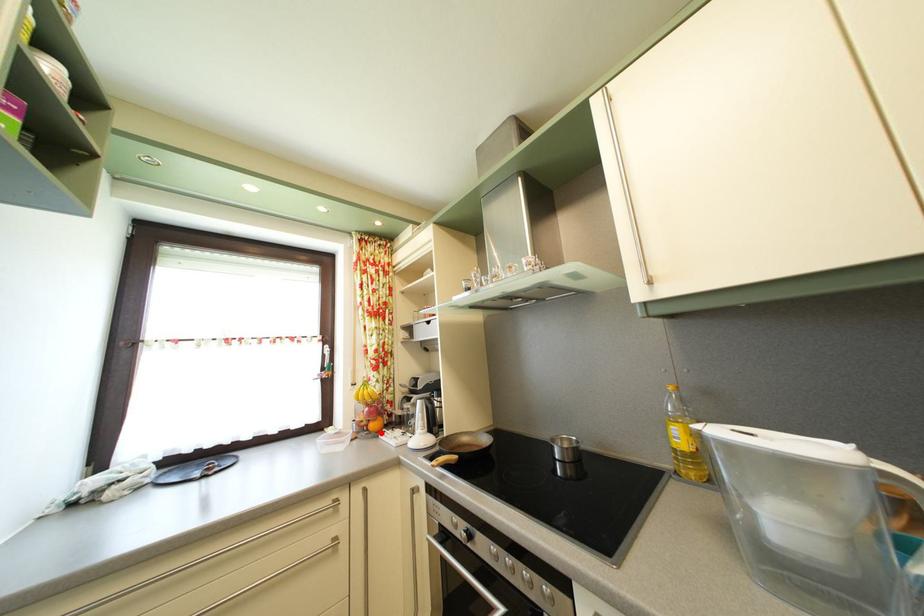
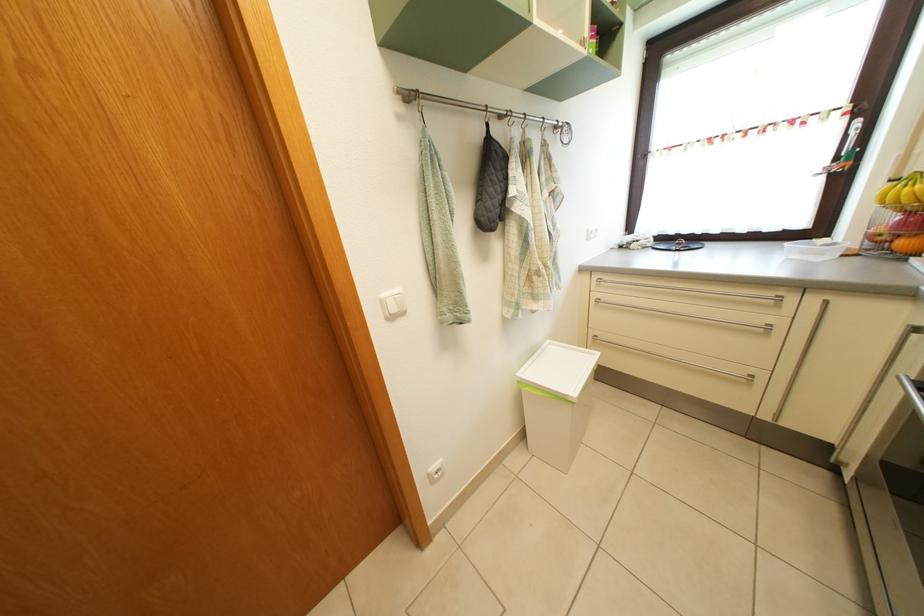
Question: I am providing you with two images of the same scene from different viewpoints. A red point is marked on the first image. At the location where the point appears in image 1, is it still visible in image 2?

Choices:
 (A) Yes
 (B) No

Answer: (A)